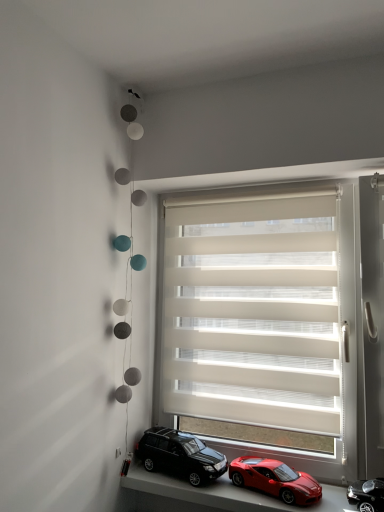
Question: Considering the relative positions of smooth plastic toy cars at lower center and beige fabric window blind at center in the image provided, is smooth plastic toy cars at lower center behind beige fabric window blind at center?

Choices:
 (A) yes
 (B) no

Answer: (B)

Question: Considering the relative sizes of smooth plastic toy cars at lower center and beige fabric window blind at center in the image provided, is smooth plastic toy cars at lower center taller than beige fabric window blind at center?

Choices:
 (A) yes
 (B) no

Answer: (B)

Question: From the image's perspective, does smooth plastic toy cars at lower center appear lower than beige fabric window blind at center?

Choices:
 (A) yes
 (B) no

Answer: (A)

Question: Can you confirm if smooth plastic toy cars at lower center is thinner than beige fabric window blind at center?

Choices:
 (A) no
 (B) yes

Answer: (A)

Question: Considering the relative positions of smooth plastic toy cars at lower center and beige fabric window blind at center in the image provided, is smooth plastic toy cars at lower center to the left of beige fabric window blind at center from the viewer's perspective?

Choices:
 (A) no
 (B) yes

Answer: (B)

Question: In terms of size, does beige fabric window blind at center appear bigger or smaller than shiny black suv at lower center, the first car in the left-to-right sequence?

Choices:
 (A) small
 (B) big

Answer: (B)

Question: Does point (281, 325) appear closer or farther from the camera than point (187, 434)?

Choices:
 (A) closer
 (B) farther

Answer: (A)

Question: Considering the positions of beige fabric window blind at center and shiny black suv at lower center, the first car in the left-to-right sequence, in the image, is beige fabric window blind at center taller or shorter than shiny black suv at lower center, the first car in the left-to-right sequence,?

Choices:
 (A) tall
 (B) short

Answer: (A)

Question: Would you say beige fabric window blind at center is to the left or to the right of shiny black suv at lower center, placed as the 3th car when sorted from right to left, in the picture?

Choices:
 (A) right
 (B) left

Answer: (A)

Question: Considering their positions, is shiny black car at lower right, acting as the 1th car starting from the right, located in front of or behind shiny black suv at lower center, the first car in the left-to-right sequence?

Choices:
 (A) behind
 (B) front

Answer: (B)

Question: Is shiny black car at lower right, acting as the 1th car starting from the right, taller or shorter than shiny black suv at lower center, the first car in the left-to-right sequence?

Choices:
 (A) short
 (B) tall

Answer: (A)

Question: Looking at their shapes, would you say shiny black car at lower right, acting as the 1th car starting from the right, is wider or thinner than shiny black suv at lower center, the first car in the left-to-right sequence?

Choices:
 (A) thin
 (B) wide

Answer: (A)

Question: From a real-world perspective, is shiny black car at lower right, acting as the 3th car starting from the left, physically located above or below shiny black suv at lower center, the first car in the left-to-right sequence?

Choices:
 (A) below
 (B) above

Answer: (A)

Question: Choose the correct answer: Is shiny black suv at lower center, placed as the 3th car when sorted from right to left, inside smooth plastic toy cars at lower center or outside it?

Choices:
 (A) outside
 (B) inside

Answer: (A)

Question: Considering the positions of shiny black suv at lower center, placed as the 3th car when sorted from right to left, and smooth plastic toy cars at lower center in the image, is shiny black suv at lower center, placed as the 3th car when sorted from right to left, taller or shorter than smooth plastic toy cars at lower center?

Choices:
 (A) short
 (B) tall

Answer: (B)